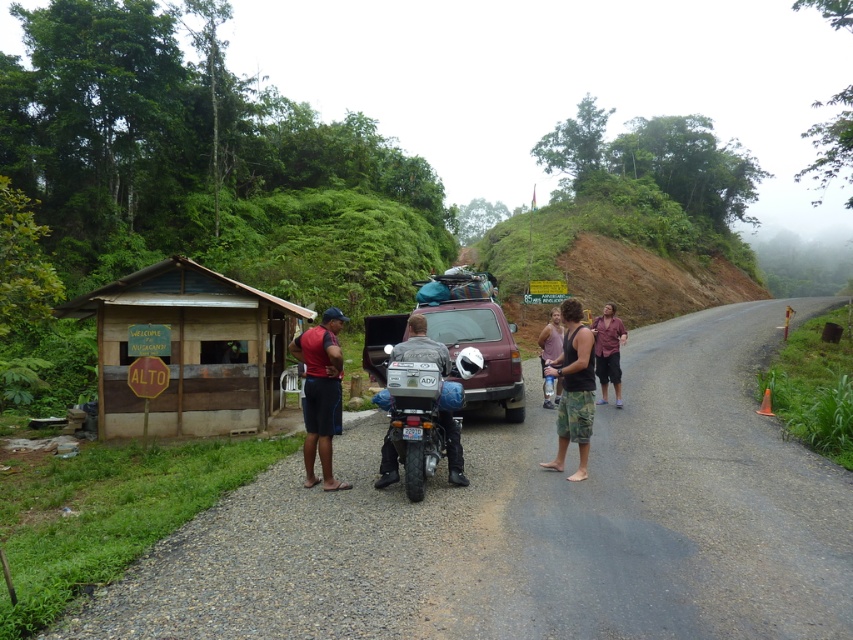
Question: Where is green grassy hill at upper center located in relation to maroon fabric shirt at center in the image?

Choices:
 (A) below
 (B) above

Answer: (B)

Question: Among these objects, which one is farthest from the camera?

Choices:
 (A) reddish-brown shorts at center
 (B) green grassy hill at upper center
 (C) camouflage shorts at right

Answer: (B)

Question: Where is maroon matte suv at center located in relation to reddish-brown shorts at center in the image?

Choices:
 (A) below
 (B) above

Answer: (B)

Question: Which point appears closest to the camera in this image?

Choices:
 (A) (601, 198)
 (B) (581, 480)

Answer: (B)

Question: Can you confirm if wooden hut at left is positioned below maroon matte suv at center?

Choices:
 (A) no
 (B) yes

Answer: (B)

Question: Estimate the real-world distances between objects in this image. Which object is closer to the maroon fabric shirt at center?

Choices:
 (A) maroon matte suv at center
 (B) camouflage shorts at center

Answer: (B)